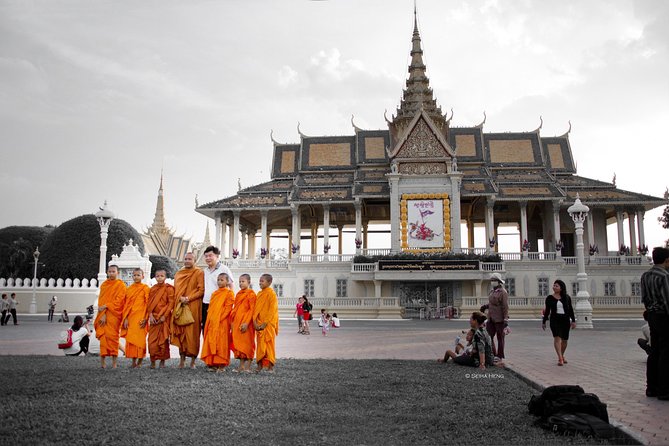
The image size is (669, 446). I want to click on pillar, so click(361, 215).